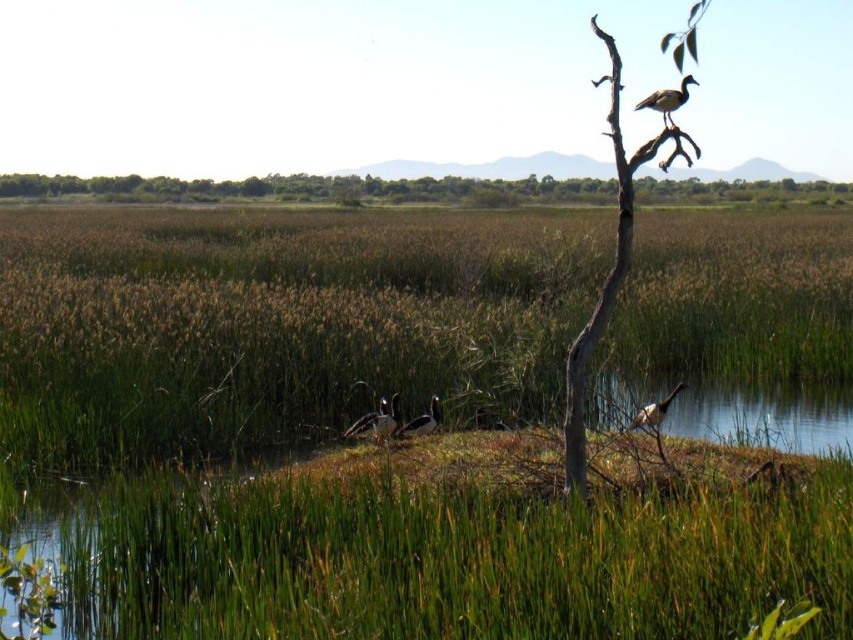
Question: From the image, what is the correct spatial relationship of green grass at center in relation to brown speckled feathers at center?

Choices:
 (A) above
 (B) below

Answer: (A)

Question: Which object is the closest to the green grassy mound at center?

Choices:
 (A) green grass at center
 (B) white glossy bird at center

Answer: (B)

Question: Which of the following is the closest to the observer?

Choices:
 (A) (584, 432)
 (B) (401, 291)
 (C) (425, 428)

Answer: (A)

Question: Is brown wood tree at upper center thinner than white glossy bird at upper right?

Choices:
 (A) no
 (B) yes

Answer: (A)

Question: Observing the image, what is the correct spatial positioning of white glossy bird at upper right in reference to white glossy bird at center?

Choices:
 (A) above
 (B) below

Answer: (A)

Question: Among these points, which one is nearest to the camera?

Choices:
 (A) (482, 428)
 (B) (662, 118)
 (C) (402, 433)

Answer: (B)